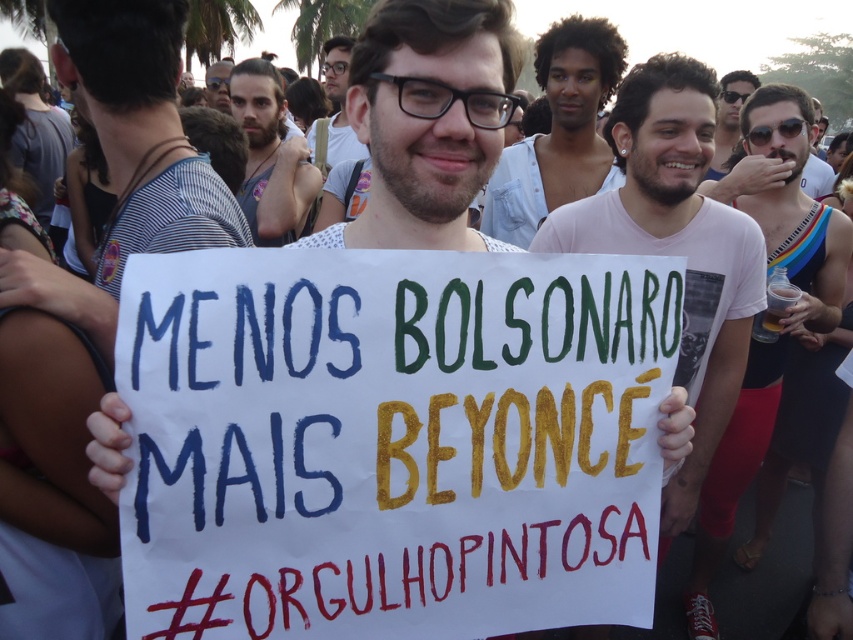
Question: Considering the real-world distances, which object is closest to the white tank top at center?

Choices:
 (A) pink cotton t-shirt at center
 (B) matte black shirt at center

Answer: (A)

Question: Is white paper sign at center thinner than gray tank top at center?

Choices:
 (A) no
 (B) yes

Answer: (B)

Question: Can you confirm if pink cotton t-shirt at center is wider than sunglasses at upper center?

Choices:
 (A) no
 (B) yes

Answer: (A)

Question: Estimate the real-world distances between objects in this image. Which object is closer to the matte black shirt at center?

Choices:
 (A) sunglasses at upper center
 (B) white paper sign at center
 (C) white tank top at center
 (D) light blue shirt at center

Answer: (D)

Question: Which point is farther to the camera?

Choices:
 (A) (352, 90)
 (B) (224, 106)

Answer: (B)

Question: Does pink cotton t-shirt at center appear over matte black shirt at center?

Choices:
 (A) no
 (B) yes

Answer: (A)